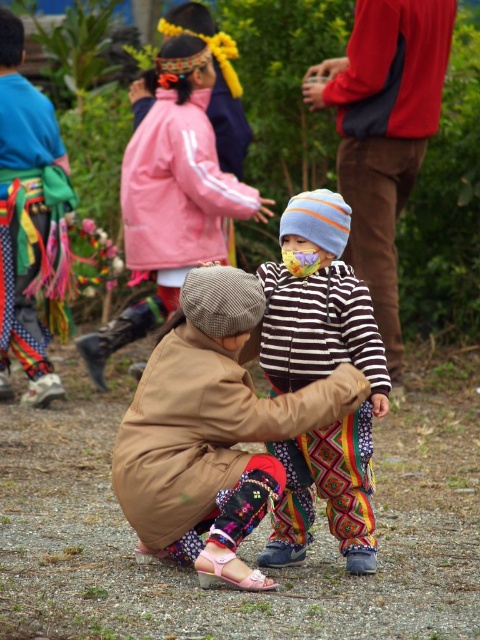
Question: Which point is farther to the camera?

Choices:
 (A) (199, 445)
 (B) (36, 234)
 (C) (440, 84)
 (D) (167, 308)

Answer: (C)

Question: Is matte pink jacket at center wider than brushed metal belt at left?

Choices:
 (A) no
 (B) yes

Answer: (B)

Question: In this image, where is striped hoodie at center located relative to matte pink jacket at center?

Choices:
 (A) right
 (B) left

Answer: (A)

Question: Which point is farther to the camera?

Choices:
 (A) matte pink jacket at center
 (B) brushed metal belt at left
 (C) striped hoodie at center

Answer: (B)

Question: Is brown fabric jacket at center in front of striped hoodie at center?

Choices:
 (A) no
 (B) yes

Answer: (B)

Question: Considering the real-world distances, which object is farthest from the matte pink jacket at center?

Choices:
 (A) brown fabric jacket at center
 (B) brushed metal belt at left

Answer: (A)